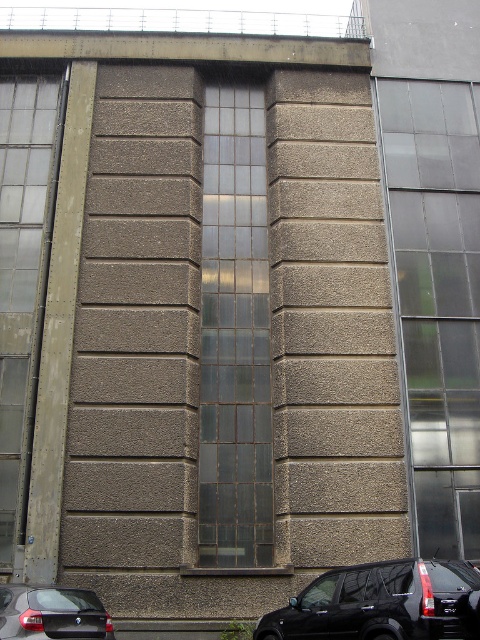
You are standing outside the industrial building and want to see the shiny black suv at lower center through the transparent glass window at right. Can you see it from your current position?

The transparent glass window at right is located above the shiny black suv at lower center, so you cannot see the shiny black suv at lower center through the window from your current position because the window is positioned higher up.

You are standing at the entrance of the industrial building and want to locate the transparent glass window at center. According to the coordinates provided, where should you look relative to your position?

The transparent glass window at center is located at coordinates point (235, 336), which means it is positioned slightly to the right and just below the center point of the building facade relative to your standing position at the entrance.